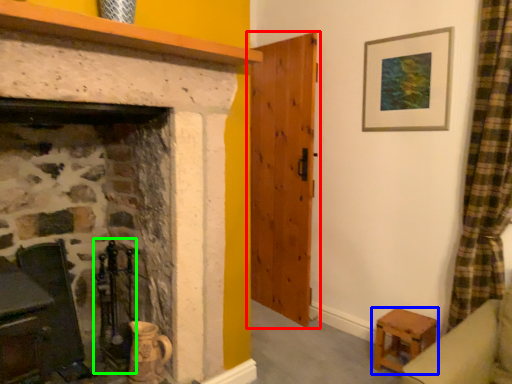
Question: Which object is the closest to the door (highlighted by a red box)? Choose among these: stool (highlighted by a blue box) or chair (highlighted by a green box).

Choices:
 (A) stool
 (B) chair

Answer: (A)